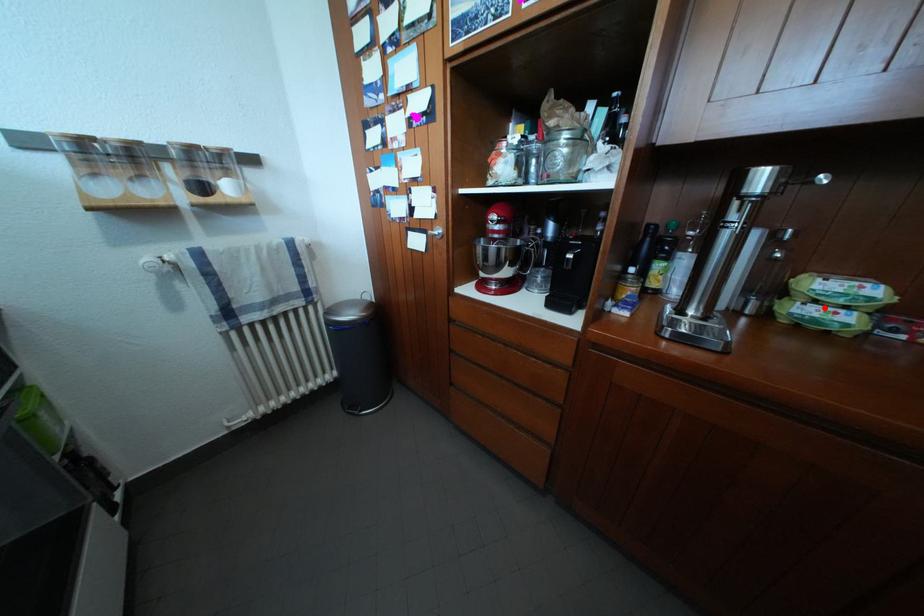
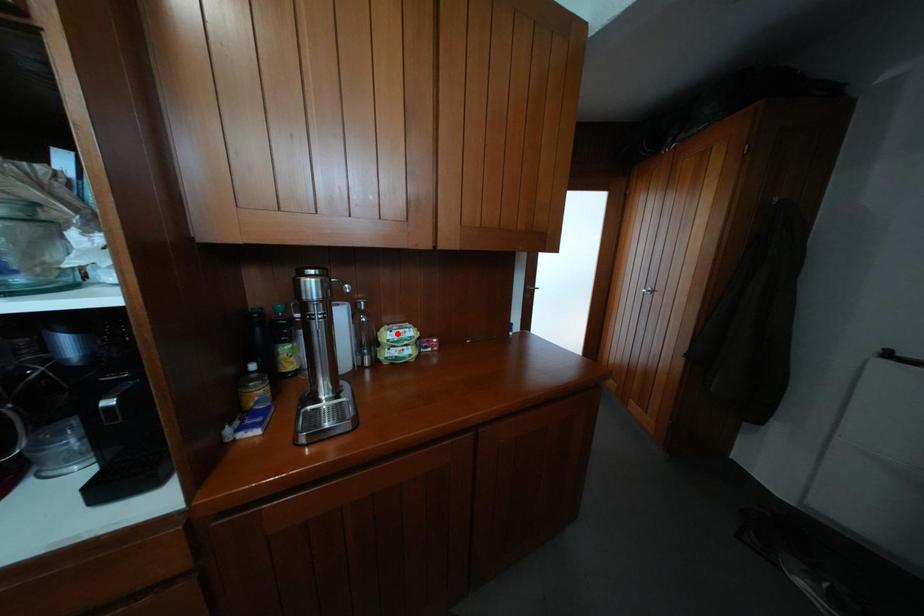
I am providing you with two images of the same scene from different viewpoints. A red point is marked on the first image and another point is marked on the second image. Are the points marked in image1 and image2 representing the same 3D position?

No